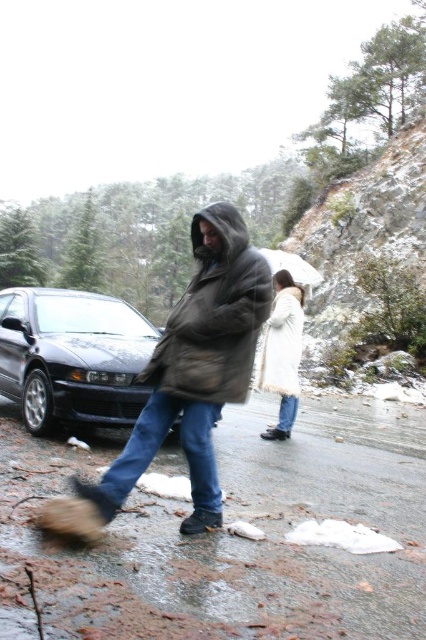
Question: Can you confirm if brown fuzzy coat at center is bigger than shiny black car at center?

Choices:
 (A) no
 (B) yes

Answer: (A)

Question: Is brown fuzzy coat at center further to the viewer compared to white fur coat at center?

Choices:
 (A) yes
 (B) no

Answer: (B)

Question: Which point is farther to the camera?

Choices:
 (A) brown fuzzy coat at center
 (B) white fur coat at center

Answer: (B)

Question: Which point is closer to the camera?

Choices:
 (A) click(121, 372)
 (B) click(195, 285)

Answer: (B)

Question: Which of the following is the farthest from the observer?

Choices:
 (A) (129, 355)
 (B) (235, 284)

Answer: (A)

Question: Is shiny black car at center above white fur coat at center?

Choices:
 (A) no
 (B) yes

Answer: (B)